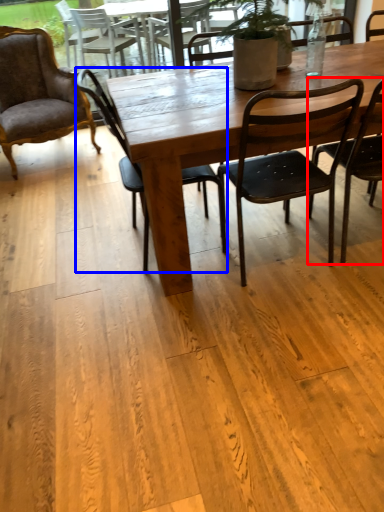
Question: Which object appears farthest to the camera in this image, chair (highlighted by a red box) or chair (highlighted by a blue box)?

Choices:
 (A) chair
 (B) chair

Answer: (B)